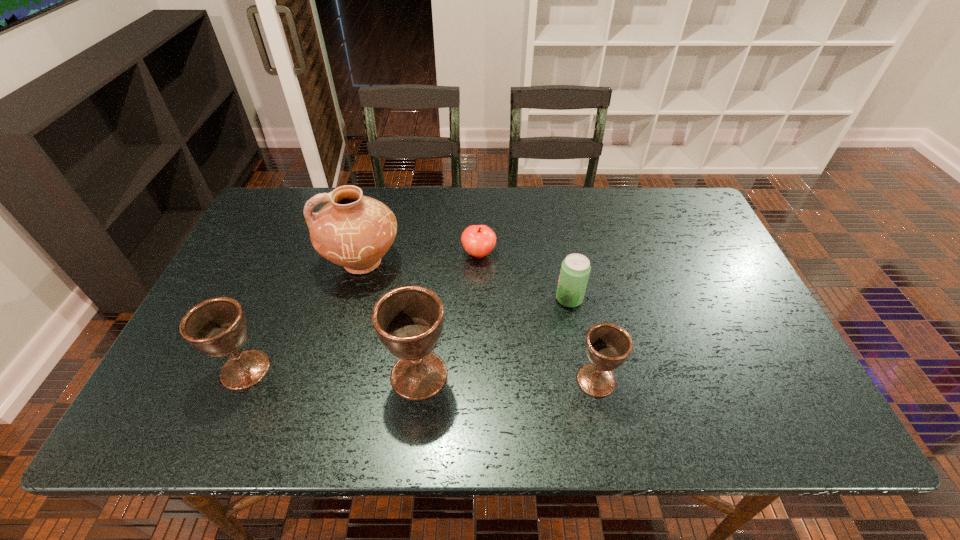
This screenshot has width=960, height=540. Find the location of `vacant spot to place a chalice on the right`. vacant spot to place a chalice on the right is located at coordinates (776, 386).